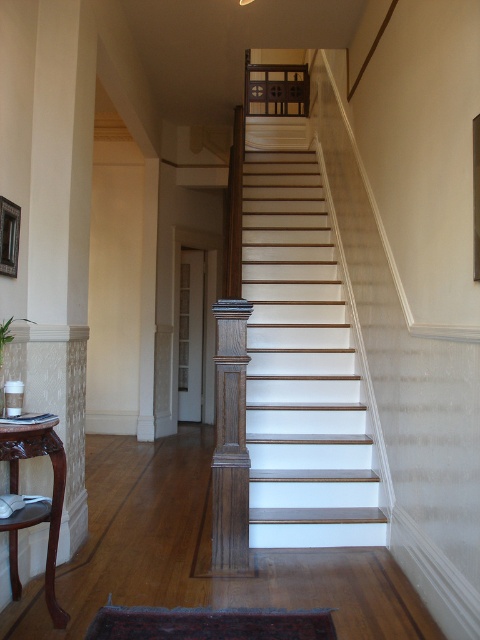
You are moving a large painting into a living room and need to choose between placing it on the brown wood table at lower left or hanging it above the wooden picture frame at upper left. Which surface can accommodate the painting based on size?

The brown wood table at lower left is bigger than the wooden picture frame at upper left, so the painting can be placed on the brown wood table at lower left.

You are standing at the bottom of the staircase and want to place a new decorative item on the brown wood table at lower left and the wooden picture frame at upper left. Based on their positions, which object is closer to the right side of the room?

The brown wood table at lower left is to the right of wooden picture frame at upper left, so the brown wood table at lower left is closer to the right side of the room.